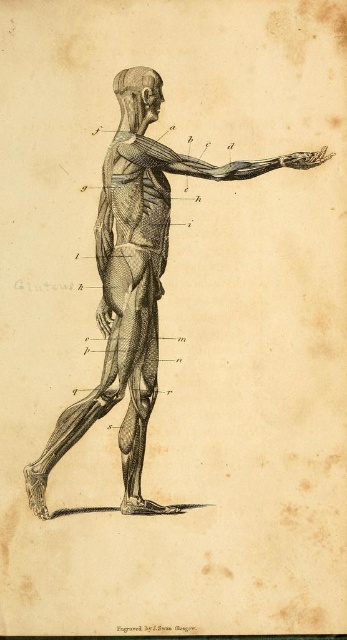
Question: Which of these objects is positioned closest to the smooth gray skull at upper center?

Choices:
 (A) black ink human figure at center
 (B) matte black arm at upper center

Answer: (B)

Question: Is black ink human figure at center in front of matte black arm at upper center?

Choices:
 (A) yes
 (B) no

Answer: (A)

Question: Can you confirm if black ink human figure at center is smaller than smooth gray skull at upper center?

Choices:
 (A) yes
 (B) no

Answer: (B)

Question: Does matte black arm at upper center have a larger size compared to smooth gray skull at upper center?

Choices:
 (A) no
 (B) yes

Answer: (B)

Question: Which point is farther to the camera?

Choices:
 (A) black ink human figure at center
 (B) matte black arm at upper center
 (C) smooth gray skull at upper center

Answer: (C)

Question: Which object appears closest to the camera in this image?

Choices:
 (A) black ink human figure at center
 (B) matte black arm at upper center
 (C) smooth gray skull at upper center

Answer: (A)